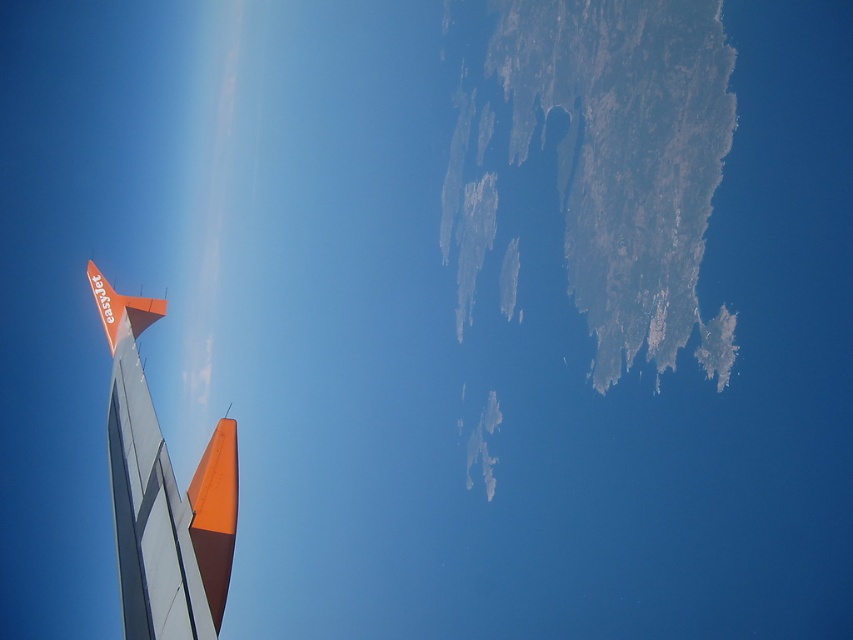
Is point (148, 508) in front of point (231, 524)?

No, it is not.

Does orange matte airplane wing at left appear on the right side of orange matte tail at lower left?

Incorrect, orange matte airplane wing at left is not on the right side of orange matte tail at lower left.

The width and height of the screenshot is (853, 640). I want to click on orange matte airplane wing at left, so click(x=161, y=493).

What are the coordinates of `orange matte airplane wing at left` in the screenshot? It's located at (161, 493).

Between orange matte airplane wing at left and orange matte airplane tail at upper left, which one appears on the right side from the viewer's perspective?

orange matte airplane wing at left

Can you confirm if orange matte airplane wing at left is positioned above orange matte airplane tail at upper left?

Incorrect, orange matte airplane wing at left is not positioned above orange matte airplane tail at upper left.

Based on the photo, who is more forward, (109, 440) or (141, 326)?

Point (109, 440) is in front.

Locate an element on the screen. This screenshot has width=853, height=640. orange matte airplane wing at left is located at coordinates (161, 493).

Which is more to the right, orange matte tail at lower left or orange matte airplane tail at upper left?

Positioned to the right is orange matte tail at lower left.

Does orange matte tail at lower left appear under orange matte airplane tail at upper left?

Yes, orange matte tail at lower left is below orange matte airplane tail at upper left.

Is point (236, 456) closer to viewer compared to point (131, 323)?

That is True.

Where is `orange matte tail at lower left`? orange matte tail at lower left is located at coordinates (215, 515).